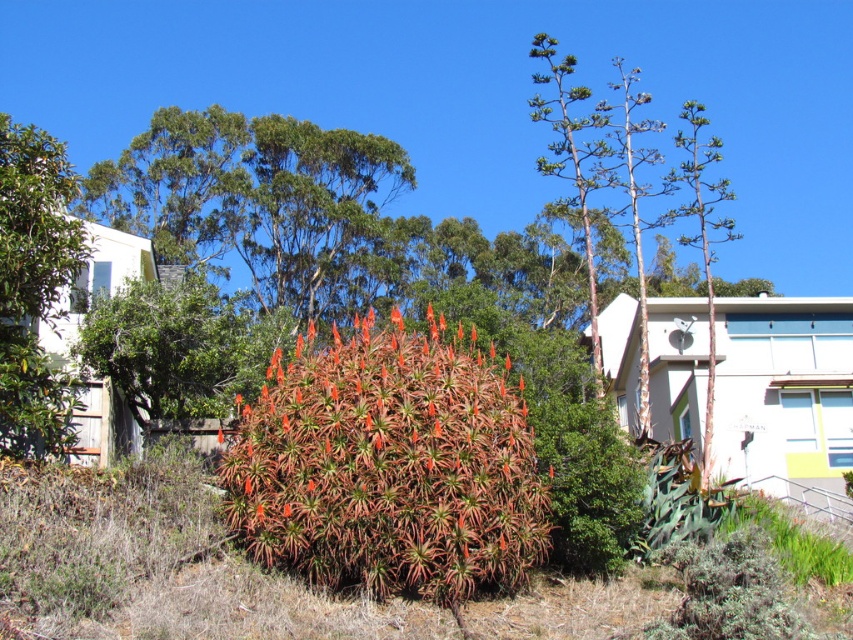
Question: Is green succulent at center thinner than green glossy leafy tree at left?

Choices:
 (A) no
 (B) yes

Answer: (B)

Question: Is green succulent at center further to camera compared to green glossy leafy tree at left?

Choices:
 (A) yes
 (B) no

Answer: (B)

Question: From the image, what is the correct spatial relationship of green succulent at center in relation to green glossy leafy tree at left?

Choices:
 (A) above
 (B) below

Answer: (B)

Question: Which point is closer to the camera?

Choices:
 (A) (15, 301)
 (B) (457, 424)

Answer: (B)

Question: Which object is farther from the camera taking this photo?

Choices:
 (A) green succulent at center
 (B) green glossy leafy tree at left

Answer: (B)